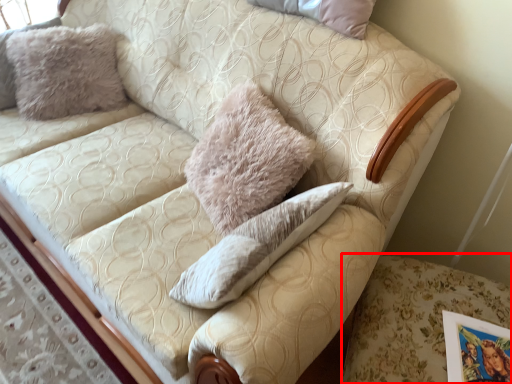
Question: Where is swivel chair (annotated by the red box) located in relation to pillow in the image?

Choices:
 (A) left
 (B) right

Answer: (B)